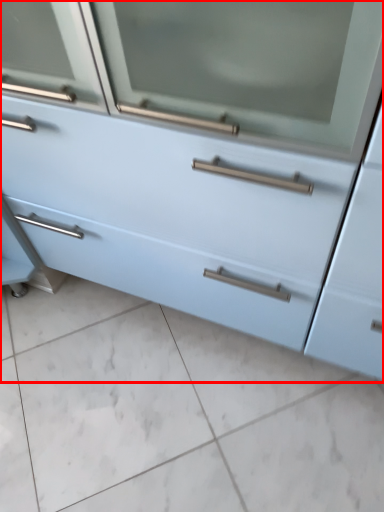
Question: From the image's perspective, where is chest of drawers (annotated by the red box) located in relation to ceramic tile in the image?

Choices:
 (A) above
 (B) below

Answer: (A)